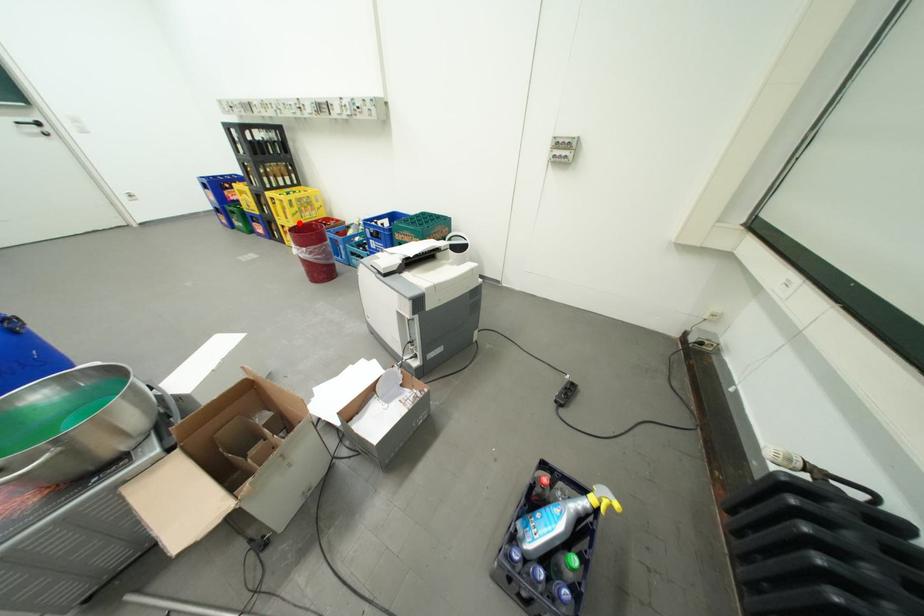
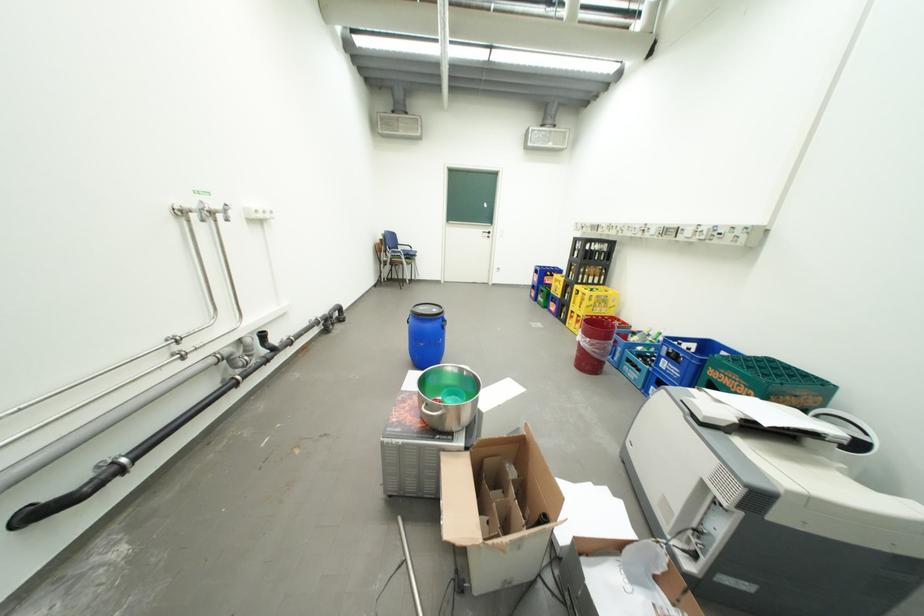
Question: I am providing you with two images of the same scene from different viewpoints. A red point is shown in image1. For the corresponding object point in image2, is it positioned nearer or farther from the camera?

Choices:
 (A) Nearer
 (B) Farther

Answer: (A)